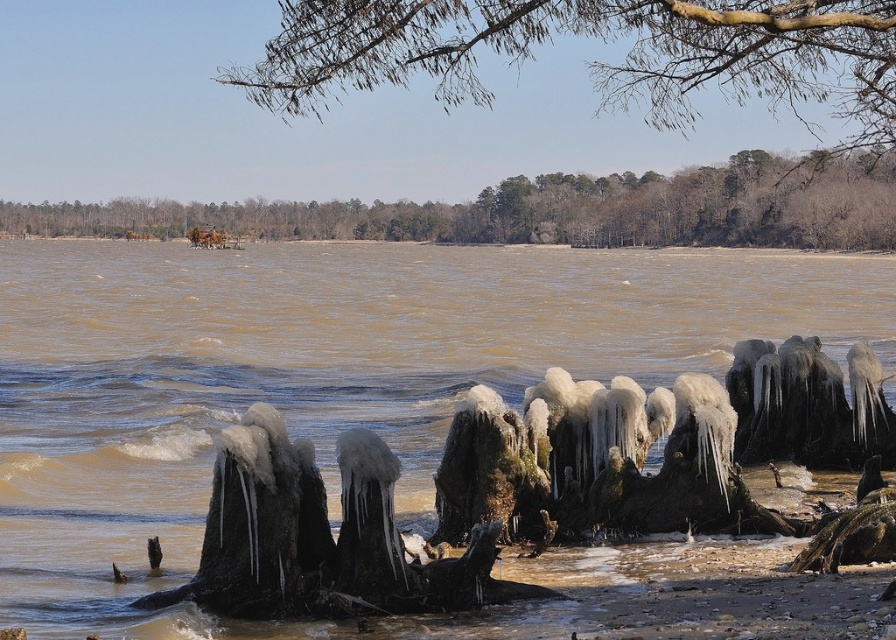
Question: Does bare branches at upper center appear on the right side of brown wood trees at upper center?

Choices:
 (A) no
 (B) yes

Answer: (B)

Question: Estimate the real-world distances between objects in this image. Which object is farther from the brown wood trees at upper center?

Choices:
 (A) bare branches at upper center
 (B) brown muddy water at center

Answer: (B)

Question: Among these points, which one is nearest to the camera?

Choices:
 (A) (x=754, y=195)
 (B) (x=582, y=278)

Answer: (B)

Question: Does brown muddy water at center have a greater width compared to brown wood trees at upper center?

Choices:
 (A) no
 (B) yes

Answer: (A)

Question: Is brown muddy water at center to the left of bare branches at upper center from the viewer's perspective?

Choices:
 (A) no
 (B) yes

Answer: (B)

Question: Among these points, which one is farthest from the camera?

Choices:
 (A) (660, 104)
 (B) (329, 372)
 (C) (596, 198)

Answer: (C)